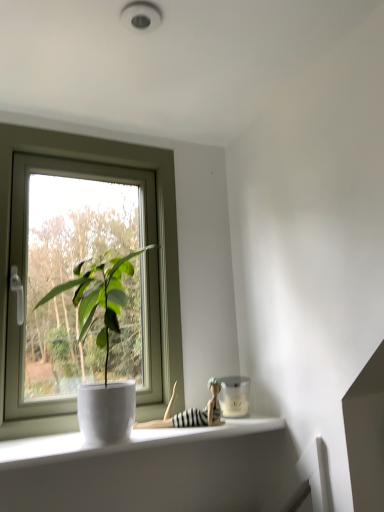
Question: Relative to white glossy pot at window, is striped fabric doll at lower center in front or behind?

Choices:
 (A) front
 (B) behind

Answer: (B)

Question: Is point [x=216, y=400] closer or farther from the camera than point [x=81, y=326]?

Choices:
 (A) farther
 (B) closer

Answer: (A)

Question: Which object is positioned farthest from the white plastic window at left?

Choices:
 (A) white glossy window sill at lower left
 (B) white glossy pot at window
 (C) striped fabric doll at lower center

Answer: (C)

Question: Which of these objects is positioned farthest from the white plastic window at left?

Choices:
 (A) white glossy window sill at lower left
 (B) striped fabric doll at lower center
 (C) white glossy pot at window

Answer: (B)